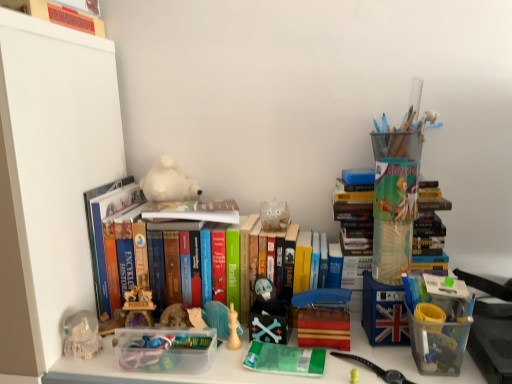
Question: Choose the correct answer: Is hardcover books at center, which is counted as the third book, starting from the top, inside white plush bear at center, which is counted as the second toy, starting from the front, or outside it?

Choices:
 (A) outside
 (B) inside

Answer: (A)

Question: From the image's perspective, is hardcover books at center, which is counted as the third book, starting from the top, positioned above or below white plush bear at center, the first toy from the top?

Choices:
 (A) below
 (B) above

Answer: (A)

Question: Which of these objects is positioned closest to the matte black skull at center, positioned as the 2th toy in top-to-bottom order?

Choices:
 (A) hardcover books at center, the 1th book from the bottom
 (B) matte red monopoly board game at upper left, which ranks as the first book in top-to-bottom order
 (C) white plush bear at center, the 1th toy from the left
 (D) hardcover book at center, the second book positioned from the bottom

Answer: (D)

Question: Considering the real-world distances, which object is farthest from the matte red monopoly board game at upper left, placed as the 3th book when sorted from bottom to top?

Choices:
 (A) hardcover books at center, the 1th book from the bottom
 (B) hardcover book at center, the 2th book viewed from the top
 (C) white plush bear at center, the 1th toy from the left
 (D) matte black skull at center, positioned as the 2th toy in top-to-bottom order

Answer: (D)